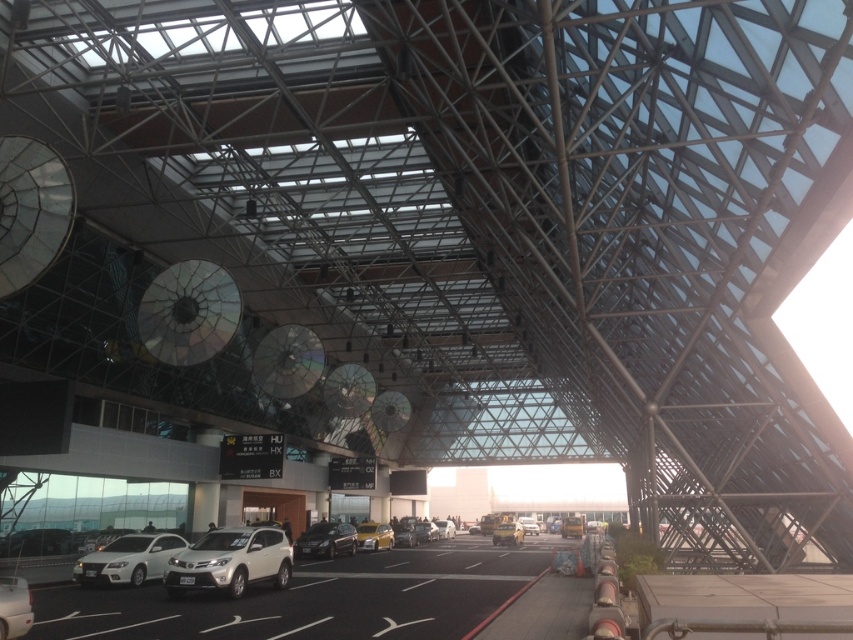
You are standing in the parking area of the airport terminal and want to locate two specific points marked on the ground. The first point is at coordinates point (282, 600) and the second is at point (175, 547). Which point is closer to your current position?

Point (282, 600) is closer to the camera than point (175, 547), so the first point is closer to your current position.